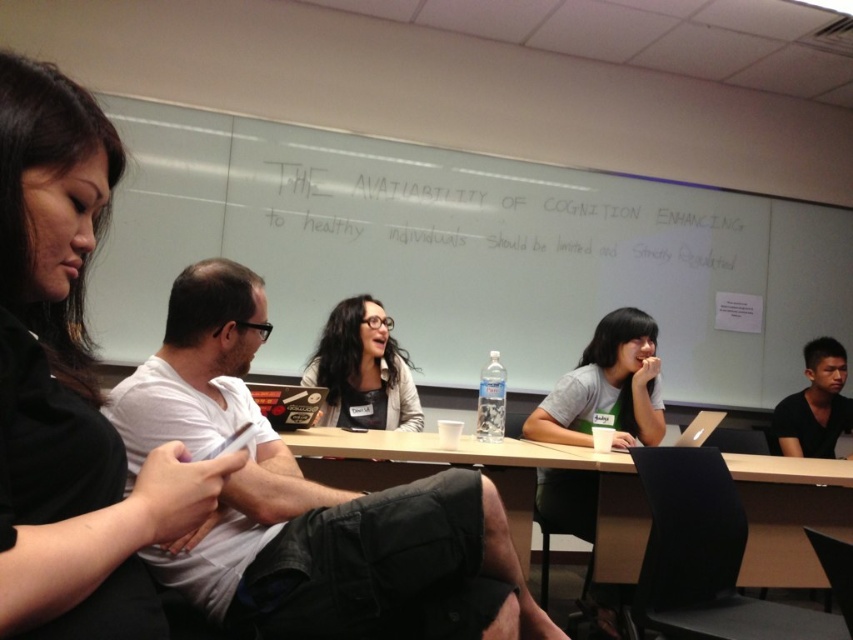
You are a student in the classroom and want to take a photo of the white chalk writing at upper center and the black matte shirt at right. Which object should you focus on first to ensure both are in the frame?

The white chalk writing at upper center is wider than the black matte shirt at right, so you should focus on the white chalk writing at upper center first to ensure both fit in the frame.

You are a student sitting in the classroom and want to read the white chalk writing at upper center. Can you reach it with your 1.8 meters long stick?

The white chalk writing at upper center is 3.43 meters from viewer. Since the stick is only 1.8 meters long, you cannot reach it.